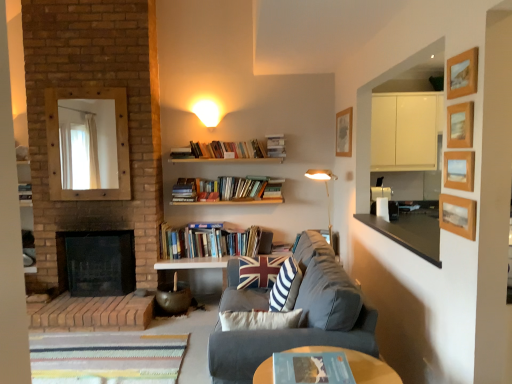
Question: From the image's perspective, is dark gray fabric couch at center located beneath wooden picture frame at upper center, the first picture frame positioned from the back?

Choices:
 (A) no
 (B) yes

Answer: (B)

Question: Is dark gray fabric couch at center wider than wooden picture frame at upper center, which appears as the fifth picture frame when viewed from the front?

Choices:
 (A) yes
 (B) no

Answer: (A)

Question: Is wooden picture frame at upper center, which ranks as the 5th picture frame in bottom-to-top order, completely or partially inside dark gray fabric couch at center?

Choices:
 (A) yes
 (B) no

Answer: (B)

Question: Is dark gray fabric couch at center touching wooden picture frame at upper center, which ranks as the 5th picture frame in bottom-to-top order?

Choices:
 (A) no
 (B) yes

Answer: (A)

Question: Is dark gray fabric couch at center completely or partially outside of wooden picture frame at upper center, which appears as the fifth picture frame when viewed from the front?

Choices:
 (A) yes
 (B) no

Answer: (A)

Question: Is dark gray fabric couch at center facing towards wooden picture frame at upper center, marked as the first picture frame in a top-to-bottom arrangement?

Choices:
 (A) yes
 (B) no

Answer: (B)

Question: Is hardcover book at upper center, acting as the 1th book starting from the back, looking in the opposite direction of hardcover books at center, marked as the 2th book in a top-to-bottom arrangement?

Choices:
 (A) no
 (B) yes

Answer: (A)

Question: From a real-world perspective, is hardcover book at upper center, the first book in the top-to-bottom sequence, below hardcover books at center, which is the second book from front to back?

Choices:
 (A) no
 (B) yes

Answer: (A)

Question: Is hardcover book at upper center, the 3th book in the front-to-back sequence, oriented towards hardcover books at center, which is the second book from front to back?

Choices:
 (A) yes
 (B) no

Answer: (B)

Question: From the image's perspective, would you say hardcover book at upper center, the first book in the top-to-bottom sequence, is positioned over hardcover books at center, marked as the 2th book in a top-to-bottom arrangement?

Choices:
 (A) no
 (B) yes

Answer: (B)

Question: Is hardcover book at upper center, the third book from the bottom, directly adjacent to hardcover books at center, marked as the 2th book in a top-to-bottom arrangement?

Choices:
 (A) no
 (B) yes

Answer: (A)

Question: Considering the relative sizes of hardcover book at upper center, the third book from the bottom, and hardcover books at center, marked as the 2th book in a top-to-bottom arrangement, in the image provided, is hardcover book at upper center, the third book from the bottom, smaller than hardcover books at center, marked as the 2th book in a top-to-bottom arrangement,?

Choices:
 (A) yes
 (B) no

Answer: (A)

Question: From a real-world perspective, is hardcover book at upper center, the third book from the bottom, beneath brick fireplace at left?

Choices:
 (A) yes
 (B) no

Answer: (B)